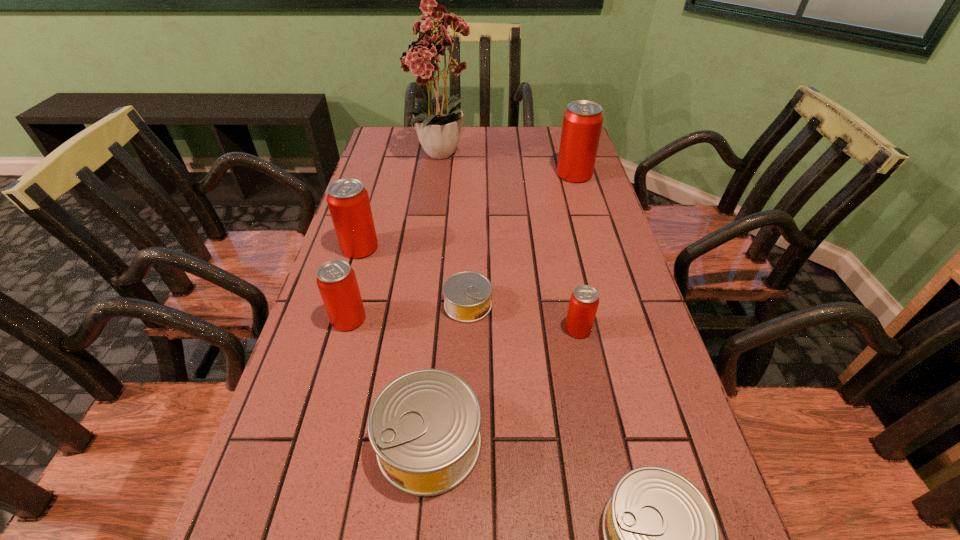
The image size is (960, 540). Identify the location of free space between the smallest red can and the biggest silver can. (504, 386).

The height and width of the screenshot is (540, 960). Identify the location of empty space that is in between the biggest silver can and the tallest can. (502, 308).

This screenshot has height=540, width=960. I want to click on free area in between the farthest silver can and the second farthest red can, so click(414, 276).

Identify which object is the sixth closest to the second smallest red can. Please provide its 2D coordinates. Your answer should be formatted as a tuple, i.e. [(x, y)], where the tuple contains the x and y coordinates of a point satisfying the conditions above.

[(661, 537)]

Locate which object is the closest to the tallest object. Please provide its 2D coordinates. Your answer should be formatted as a tuple, i.e. [(x, y)], where the tuple contains the x and y coordinates of a point satisfying the conditions above.

[(582, 123)]

Locate an element on the screen. can that stands as the fifth closest to the sixth nearest object is located at coordinates (582, 123).

This screenshot has height=540, width=960. Find the location of `can object that ranks as the third closest to the seventh tallest object`. can object that ranks as the third closest to the seventh tallest object is located at coordinates (467, 295).

The height and width of the screenshot is (540, 960). Identify the location of the third closest red can to the farthest silver can. (348, 201).

At what (x,y) coordinates should I click in order to perform the action: click on the third closest red can to the second smallest red can. Please return your answer as a coordinate pair (x, y). The width and height of the screenshot is (960, 540). Looking at the image, I should click on (582, 123).

Where is `silver can identified as the closest to the second shortest can`? silver can identified as the closest to the second shortest can is located at coordinates (424, 426).